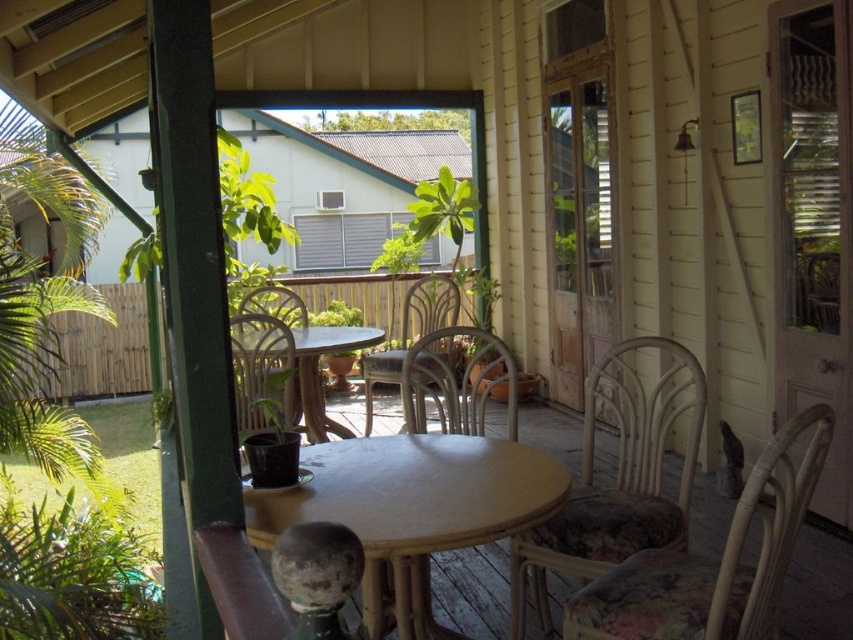
Does rattan chair at center lie in front of matte wicker chair at center?

No, it is not.

What do you see at coordinates (457, 380) in the screenshot? I see `rattan chair at center` at bounding box center [457, 380].

Is point (477, 372) farther from camera compared to point (407, 369)?

Yes.

Where is `rattan chair at center`? rattan chair at center is located at coordinates (457, 380).

Which is behind, point (618, 524) or point (706, 580)?

Point (618, 524)

Is floral fabric chair at center smaller than woven rattan chair at lower right?

Actually, floral fabric chair at center might be larger than woven rattan chair at lower right.

Is point (645, 529) positioned before point (744, 634)?

No, it is behind (744, 634).

You are a GUI agent. You are given a task and a screenshot of the screen. Output one action in this format:
    pyautogui.click(x=<x>, y=<y>)
    Task: Click on the floral fabric chair at center
    
    Given the screenshot: What is the action you would take?
    pyautogui.click(x=616, y=477)

How distant is smooth white table at center from metallic silver chair at center?

smooth white table at center and metallic silver chair at center are 2.68 meters apart.

Consider the image. Between smooth white table at center and metallic silver chair at center, which one appears on the right side from the viewer's perspective?

smooth white table at center

Which is behind, point (253, 508) or point (422, 278)?

Point (422, 278)

Find the location of a particular element. smooth white table at center is located at coordinates (413, 508).